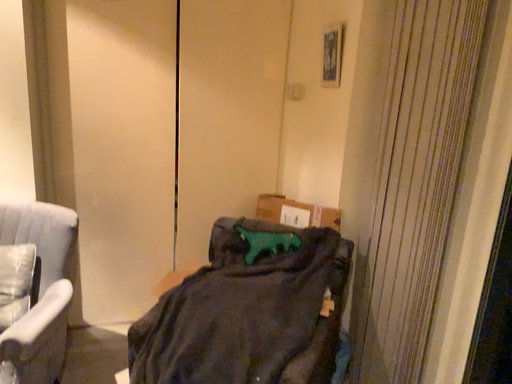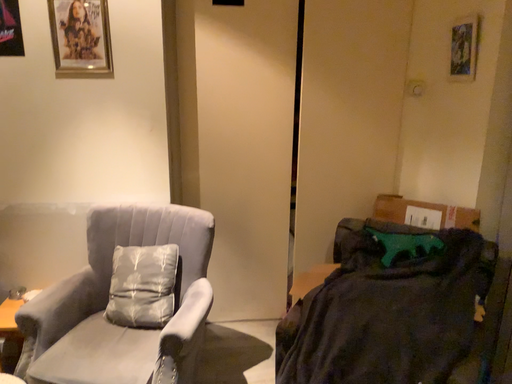
Question: Which way did the camera rotate in the video?

Choices:
 (A) rotated left
 (B) rotated right

Answer: (A)